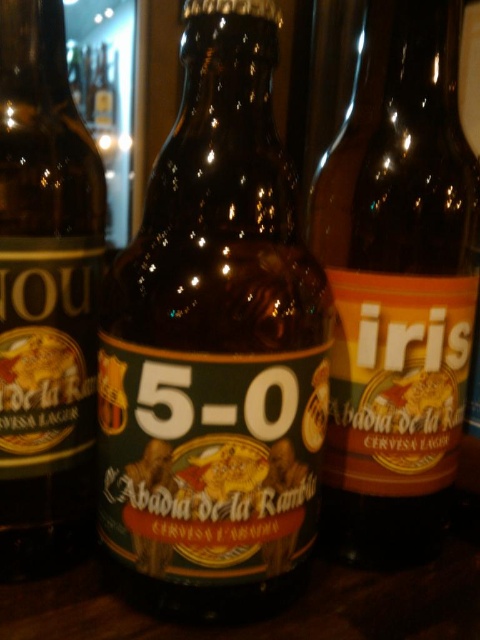
Question: In this image, where is brown glass bottle at center located relative to brown glass bottle at left?

Choices:
 (A) left
 (B) right

Answer: (B)

Question: Can you confirm if brown glass bottle at center is positioned to the right of matte glass bottle at right?

Choices:
 (A) yes
 (B) no

Answer: (B)

Question: Can you confirm if brown glass bottle at center is positioned to the right of brown glass bottle at left?

Choices:
 (A) no
 (B) yes

Answer: (B)

Question: Estimate the real-world distances between objects in this image. Which object is farther from the brown glass bottle at center?

Choices:
 (A) matte glass bottle at right
 (B) brown glass bottle at left

Answer: (A)

Question: Among these objects, which one is farthest from the camera?

Choices:
 (A) brown glass bottle at left
 (B) matte glass bottle at right
 (C) brown glass bottle at center

Answer: (B)

Question: Which object is farther from the camera taking this photo?

Choices:
 (A) brown glass bottle at left
 (B) matte glass bottle at right

Answer: (B)